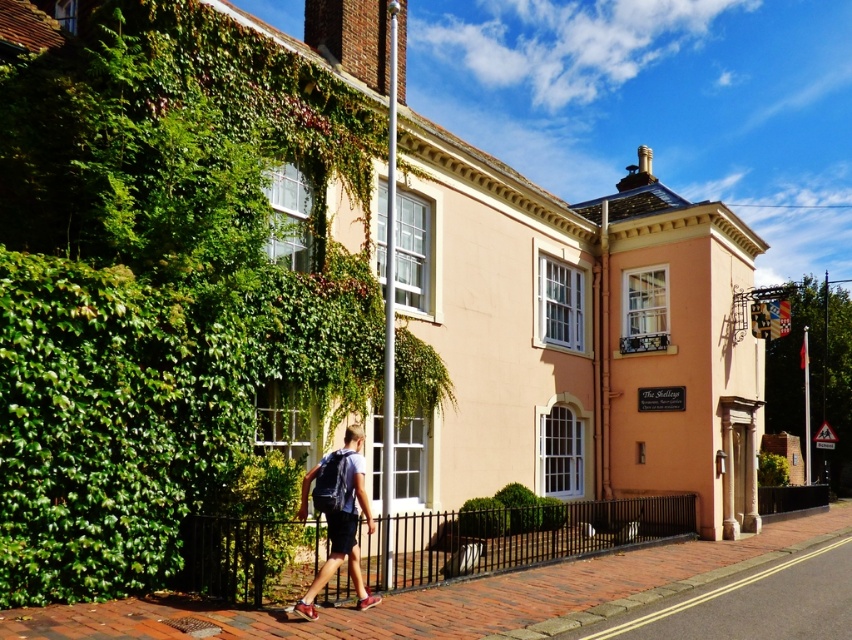
Who is lower down, green ivy hedge at left or brick pavement at lower center?

brick pavement at lower center is below.

Does green ivy hedge at left appear on the right side of brick pavement at lower center?

No, green ivy hedge at left is not to the right of brick pavement at lower center.

Find the location of a particular element. green ivy hedge at left is located at coordinates (160, 285).

Locate an element on the screen. The width and height of the screenshot is (852, 640). green ivy hedge at left is located at coordinates (160, 285).

Is the position of green ivy hedge at left more distant than that of denim shorts at lower left?

Yes.

Between green ivy hedge at left and denim shorts at lower left, which one appears on the left side from the viewer's perspective?

green ivy hedge at left

Is point (174, 468) closer to viewer compared to point (306, 593)?

No.

In order to click on green ivy hedge at left in this screenshot , I will do `click(160, 285)`.

Consider the image. Who is more forward, (734, 545) or (323, 497)?

Point (323, 497)

Between point (755, 547) and point (327, 522), which one is positioned behind?

The point (755, 547) is behind.

I want to click on brick pavement at lower center, so click(x=453, y=595).